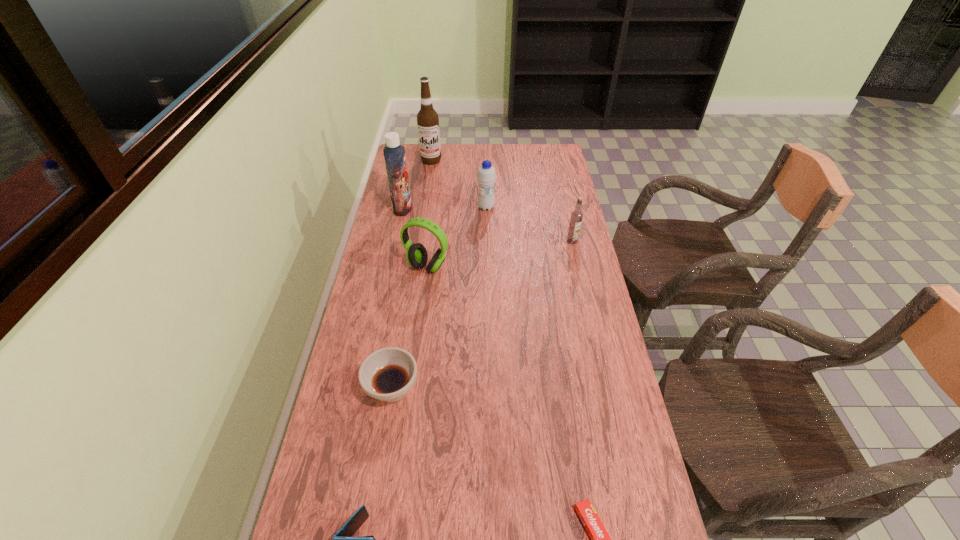
Where is `free location located 0.360m on the front label of the second tallest object`? free location located 0.360m on the front label of the second tallest object is located at coordinates (502, 208).

Where is `free space located on the back of the third object from right to left`? free space located on the back of the third object from right to left is located at coordinates (486, 153).

The width and height of the screenshot is (960, 540). In order to click on vacant region located on the right of the headset in this screenshot , I will do `click(546, 267)`.

Identify the location of free space located on the label of the rightmost object. (588, 315).

The image size is (960, 540). Identify the location of vacant region located on the back of the third shortest object. (409, 286).

You are a GUI agent. You are given a task and a screenshot of the screen. Output one action in this format:
    pyautogui.click(x=<x>, y=<y>)
    Task: Click on the object that is at the far edge
    The height and width of the screenshot is (540, 960).
    Given the screenshot: What is the action you would take?
    pyautogui.click(x=427, y=118)

This screenshot has height=540, width=960. What are the coordinates of `alcohol located at the left edge` in the screenshot? It's located at (427, 118).

Image resolution: width=960 pixels, height=540 pixels. I want to click on shampoo that is at the left edge, so click(394, 154).

Find the location of `headset that is at the left edge`. headset that is at the left edge is located at coordinates (416, 255).

Find the location of `soup bowl situated at the left edge`. soup bowl situated at the left edge is located at coordinates (387, 374).